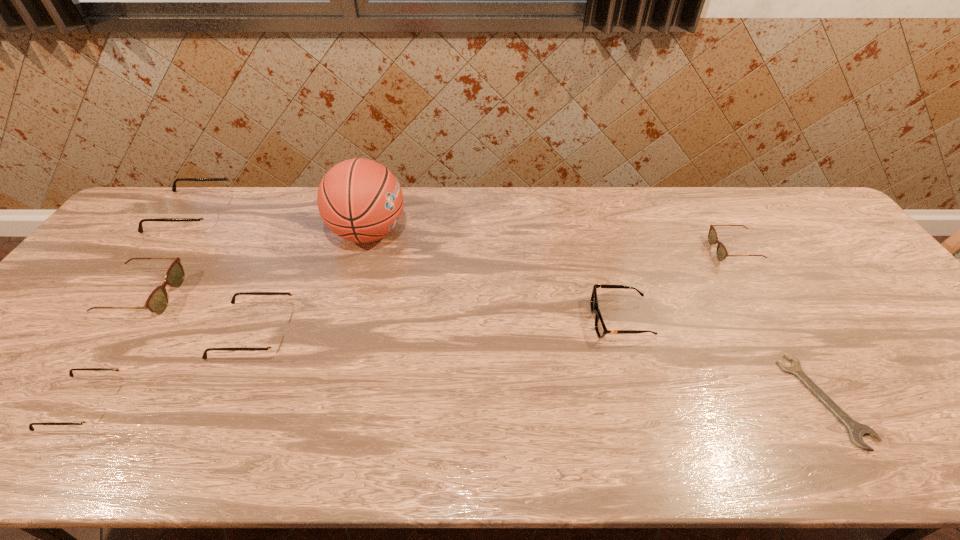
The width and height of the screenshot is (960, 540). Identify the location of free space located on the front-facing side of the third object from right to left. tap(451, 320).

Find the location of a particular element. This screenshot has height=540, width=960. vacant space located at the front view of the rightmost spectacles is located at coordinates (643, 251).

At what (x,y) coordinates should I click in order to perform the action: click on free spot located 0.400m at the front view of the rightmost spectacles. Please return your answer as a coordinate pair (x, y). This screenshot has width=960, height=540. Looking at the image, I should click on (580, 251).

Locate an element on the screen. The height and width of the screenshot is (540, 960). vacant space positioned 0.280m at the front view of the rightmost spectacles is located at coordinates (620, 251).

The width and height of the screenshot is (960, 540). Identify the location of vacant space situated 0.280m at the hinge ends of the smallest black spectacles. (243, 404).

Locate an element on the screen. The image size is (960, 540). vacant space located on the right of the wrench is located at coordinates (937, 400).

This screenshot has height=540, width=960. Find the location of `basketball that is at the far edge`. basketball that is at the far edge is located at coordinates (360, 200).

You are a GUI agent. You are given a task and a screenshot of the screen. Output one action in this format:
    pyautogui.click(x=<x>, y=<y>)
    Task: Click on the spectacles present at the far edge
    
    Given the screenshot: What is the action you would take?
    pyautogui.click(x=210, y=218)

Identify the location of spectacles at the near edge. (95, 415).

Find the location of `wrench positioned at the near edge`. wrench positioned at the near edge is located at coordinates (856, 430).